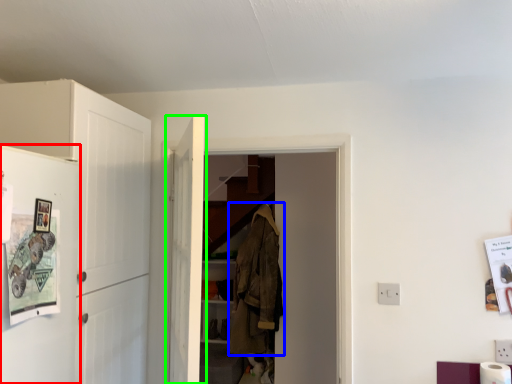
Question: Which is farther away from fridge (highlighted by a red box)? clothing (highlighted by a blue box) or door (highlighted by a green box)?

Choices:
 (A) clothing
 (B) door

Answer: (A)